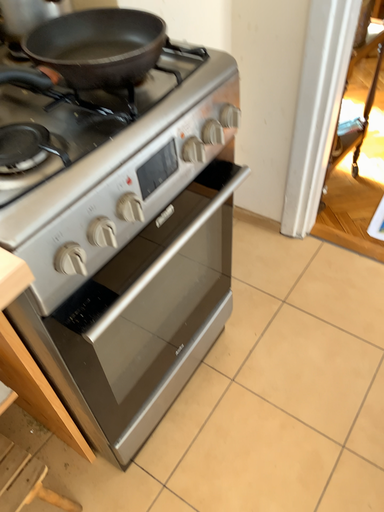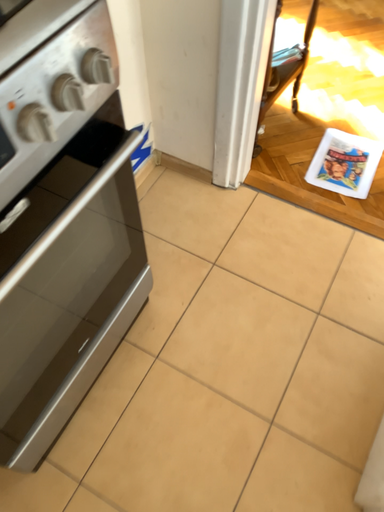
Question: Which way did the camera rotate in the video?

Choices:
 (A) rotated right
 (B) rotated left

Answer: (A)